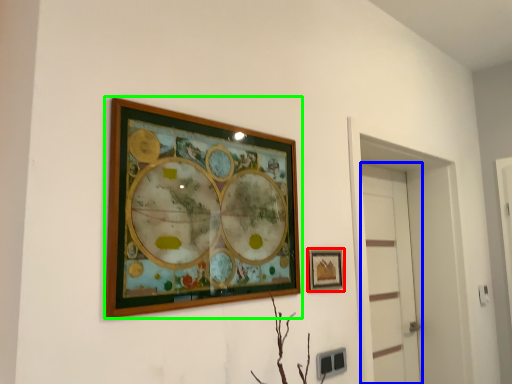
Question: Which is farther away from picture frame (highlighted by a red box)? door (highlighted by a blue box) or picture frame (highlighted by a green box)?

Choices:
 (A) door
 (B) picture frame

Answer: (A)